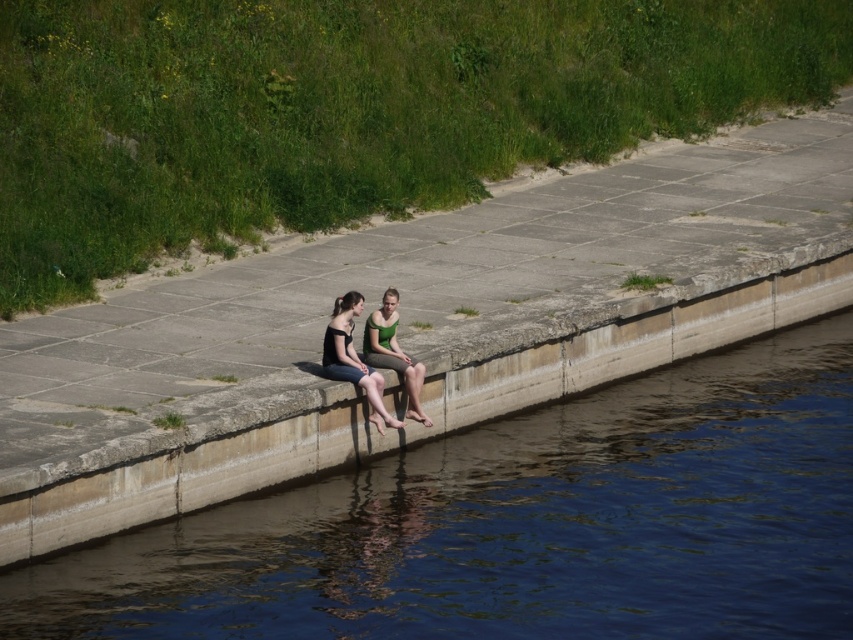
You are a photographer standing near the two people on the concrete ledge. You want to take a photo that includes both the matte black tank top at center and the green matte dress at center without any part of them being cut off. What is the minimum width of your camera lens in inches to capture both subjects?

The minimum width of the camera lens should be at least 13.91 inches to ensure both the matte black tank top at center and the green matte dress at center are fully captured without any parts being cut off.

You are a photographer trying to capture a candid shot of the two people sitting on the concrete ledge. Since you want to ensure the matte black tank top at center and the green matte dress at center are both visible in the frame, which direction should you position yourself relative to the subjects?

You should position yourself to the right of the subjects so that both the matte black tank top at center and the green matte dress at center are visible in the frame. Since the matte black tank top at center is to the left of the green matte dress at center, positioning yourself to the right would allow you to see both clothing items without obstruction.

You are a photographer trying to capture both the matte black tank top at center and the green matte dress at center in a single frame. Which object should you focus on first to ensure both are in the frame?

Since the matte black tank top at center is larger in size than the green matte dress at center, you should focus on the matte black tank top at center first to ensure both fit within the frame.